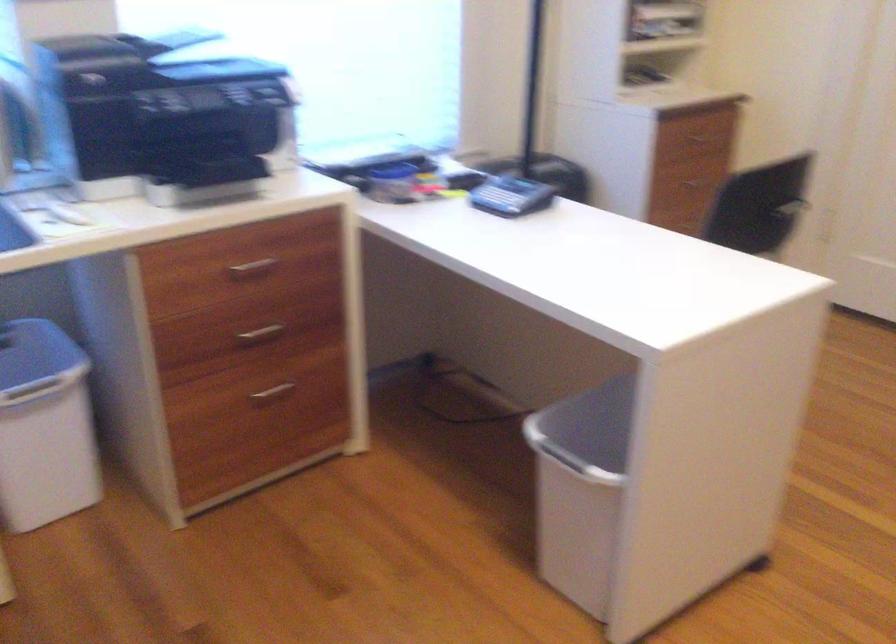
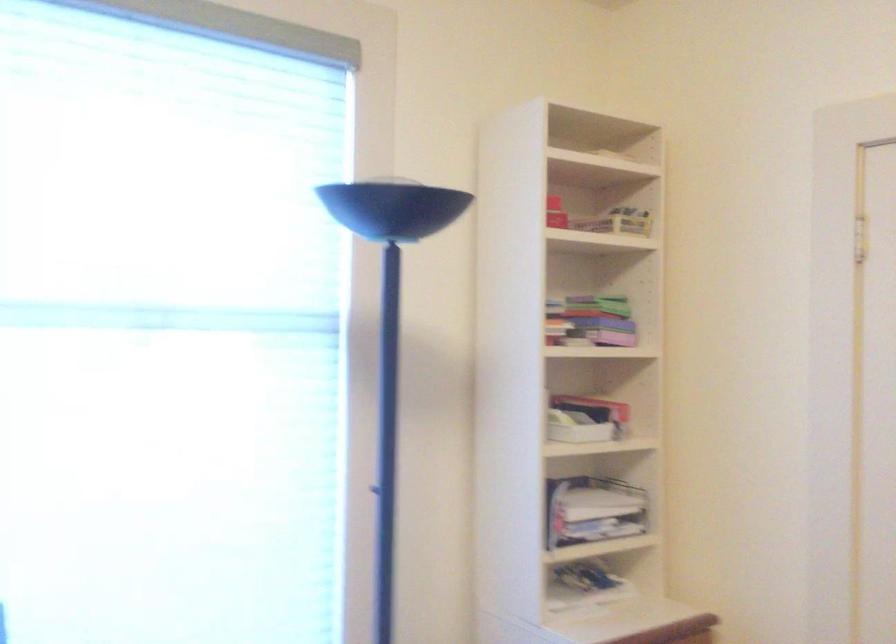
Question: Based on the continuous images, in which direction is the camera rotating? Reply with the corresponding letter.

Choices:
 (A) Left
 (B) Right
 (C) Up
 (D) Down

Answer: (C)